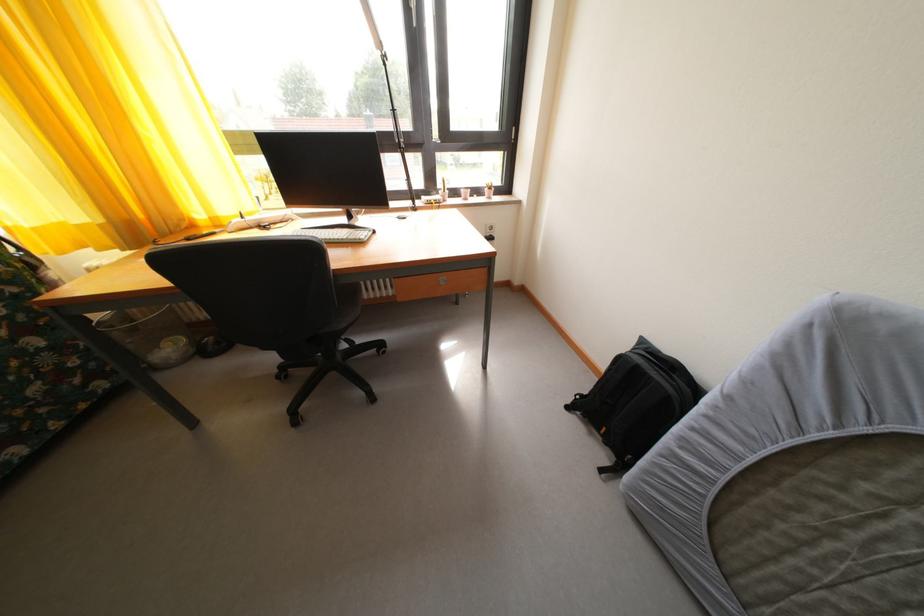
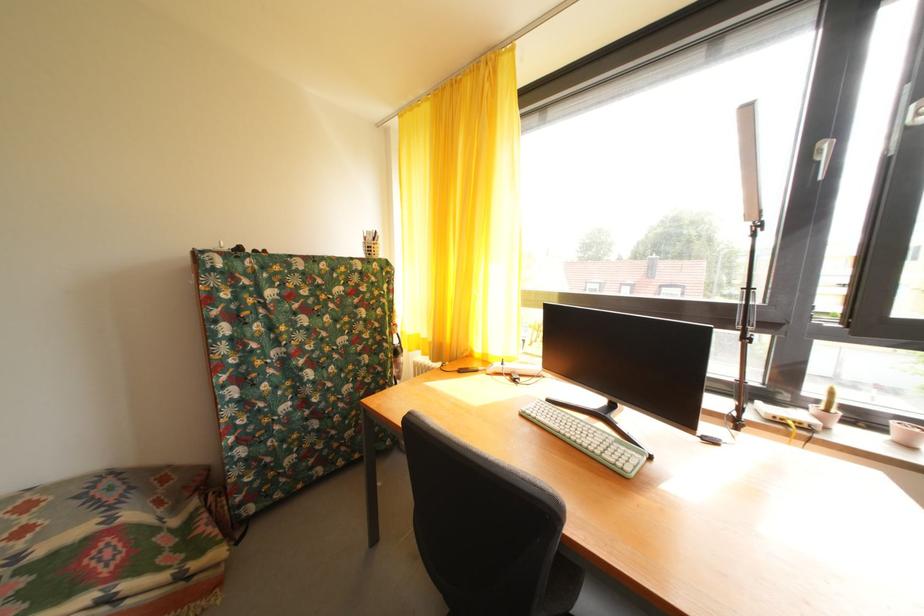
Locate, in the second image, the point that corresponds to (432,203) in the first image.

(768, 408)